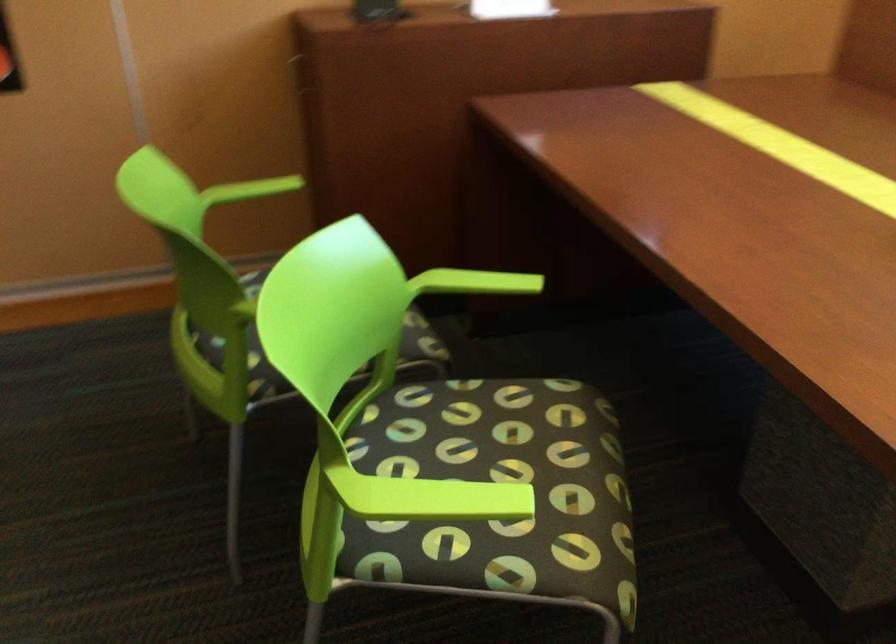
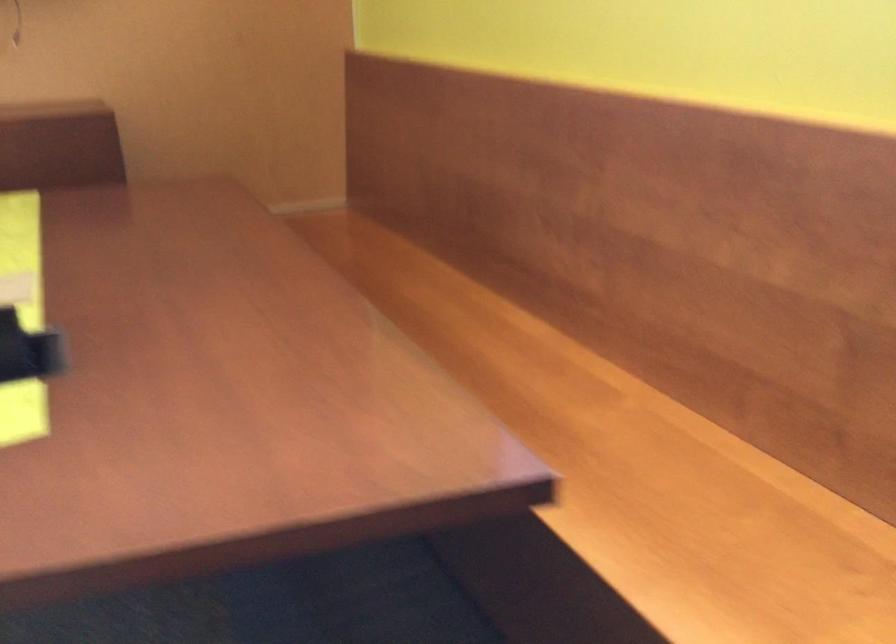
Question: In a continuous first-person perspective shot, in which direction is the camera moving?

Choices:
 (A) Left
 (B) Right
 (C) Forward
 (D) Backward

Answer: (B)